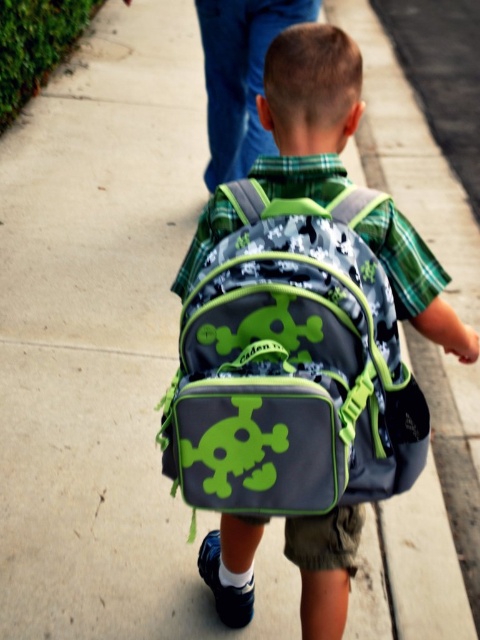
You are a teacher observing a student walking away. You see the matte gray backpack with green accents at center and the matte black backpack at center. Which backpack is taller?

The matte gray backpack with green accents at center is taller than the matte black backpack at center.